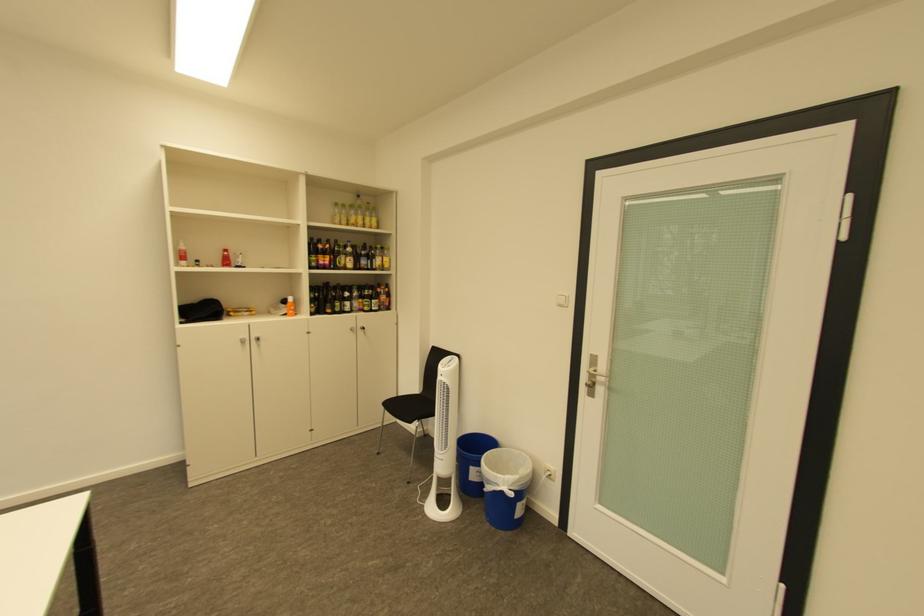
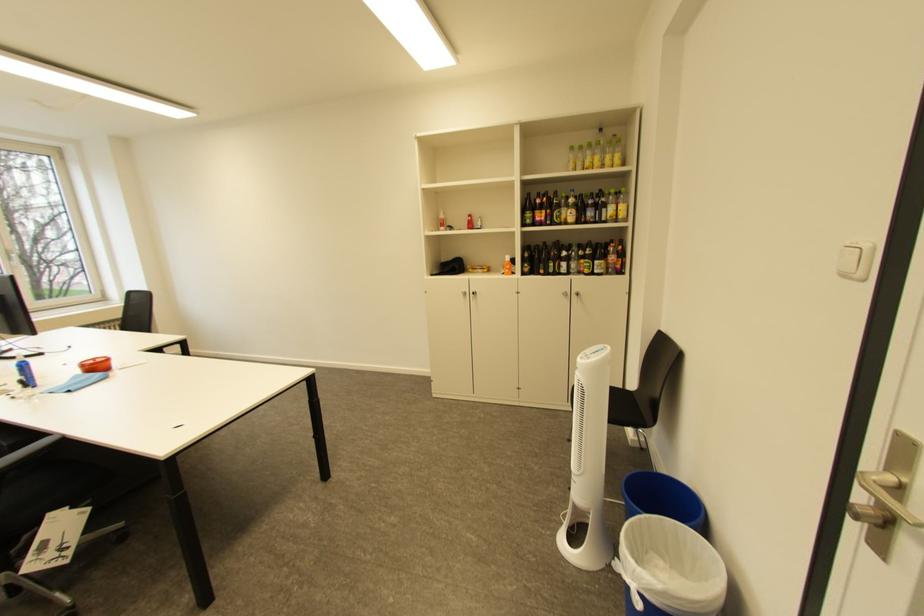
Find the pixel in the second image that matches (x=381, y=257) in the first image.

(610, 208)